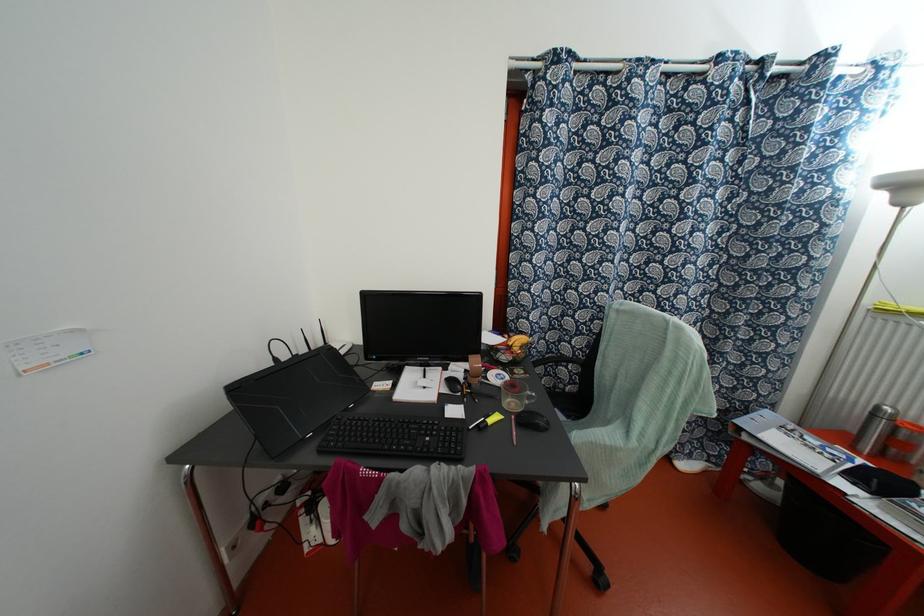
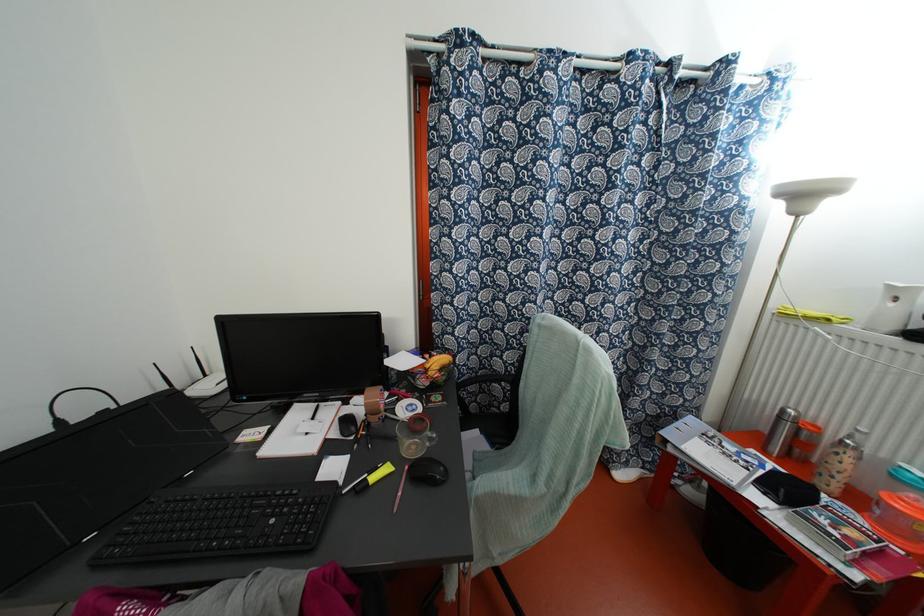
In a continuous first-person perspective shot, in which direction is the camera moving?

The movement direction of the cameraman is right, forward.